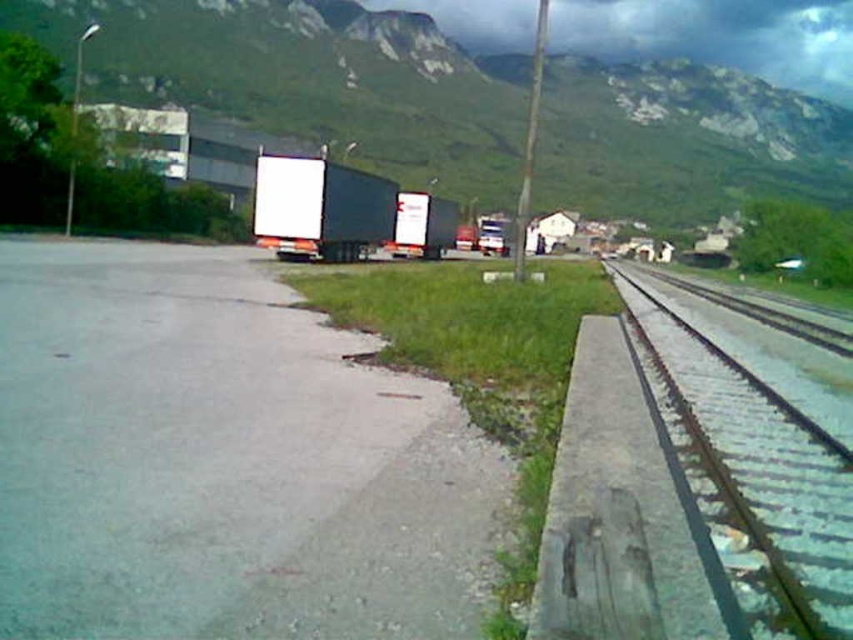
Question: Can you confirm if green metallic track at right is wider than matte black trailer truck at center?

Choices:
 (A) no
 (B) yes

Answer: (A)

Question: Does green grassy mountain at upper center appear over matte black trailer truck at center?

Choices:
 (A) yes
 (B) no

Answer: (A)

Question: Which point is closer to the camera?

Choices:
 (A) tap(281, 198)
 (B) tap(663, 378)
 (C) tap(181, 74)

Answer: (B)

Question: Which object appears closest to the camera in this image?

Choices:
 (A) matte black trailer truck at center
 (B) green metallic track at right
 (C) green grassy mountain at upper center

Answer: (B)

Question: Where is green grassy mountain at upper center located in relation to matte black trailer truck at center in the image?

Choices:
 (A) below
 (B) above

Answer: (B)

Question: Which of the following is the closest to the observer?

Choices:
 (A) (263, 209)
 (B) (189, 65)

Answer: (A)